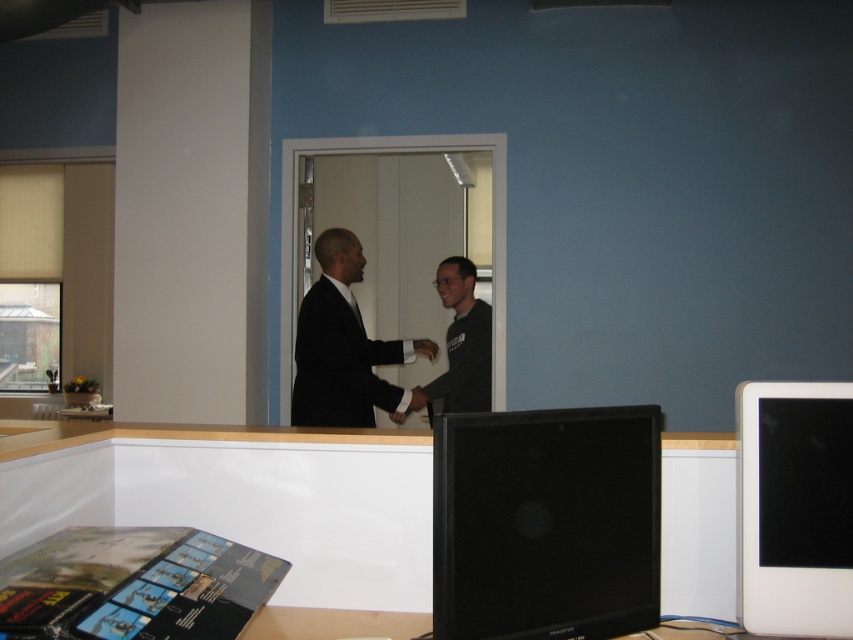
Consider the image. Between black glossy monitor at center and white glossy monitor at right, which one has less height?

Standing shorter between the two is black glossy monitor at center.

Measure the distance between point (647, 416) and camera.

Point (647, 416) is 4.34 feet away from camera.

At what (x,y) coordinates should I click in order to perform the action: click on black glossy monitor at center. Please return your answer as a coordinate pair (x, y). Looking at the image, I should click on (546, 524).

Between black glossy monitor at center and black matte hand at center, which one has less height?

black matte hand at center

Describe the element at coordinates (546, 524) in the screenshot. I see `black glossy monitor at center` at that location.

Where is `black glossy monitor at center`? The image size is (853, 640). black glossy monitor at center is located at coordinates (546, 524).

Is dark gray sweater at center to the left of black matte hand at center from the viewer's perspective?

In fact, dark gray sweater at center is to the right of black matte hand at center.

Who is more forward, (485,307) or (410,392)?

Point (410,392) is in front.

Does point (434, 380) lie in front of point (418, 394)?

No, (434, 380) is behind (418, 394).

Image resolution: width=853 pixels, height=640 pixels. I want to click on dark gray sweater at center, so click(x=462, y=342).